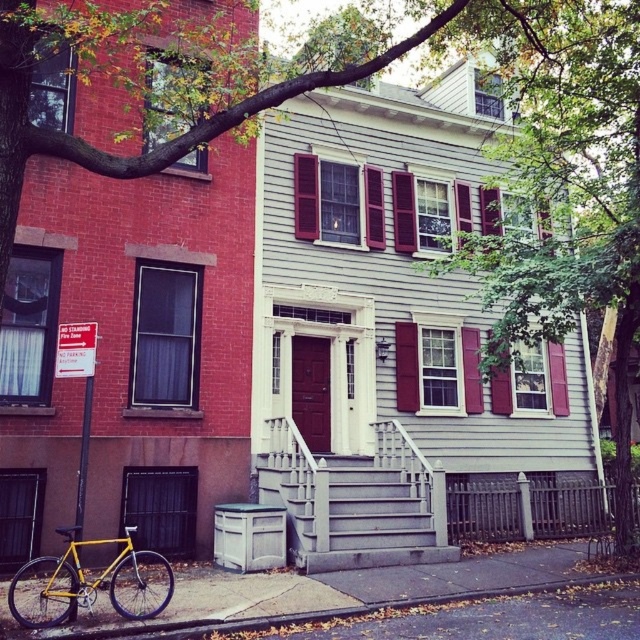
What are the coordinates of the gray wooden stairs at center?

The gray wooden stairs at center are located at coordinates point (355,516).

You are a delivery person with a cart that is 3 meters wide. You need to move from the yellow matte bicycle at lower left to the gray wooden stairs at center. Can your cart fit through the space between them?

The distance between the yellow matte bicycle at lower left and the gray wooden stairs at center is 2.75 meters. Since the cart is 3 meters wide, it cannot fit through the space between them as the distance is narrower than the cart.

From the picture: You are a delivery person trying to park your yellow matte bicycle at lower left near the gray wooden stairs at center. Considering the space between them, can the bicycle fit sideways without touching the stairs?

The gray wooden stairs at center is wider than the yellow matte bicycle at lower left, so the bicycle can fit sideways without touching the stairs.